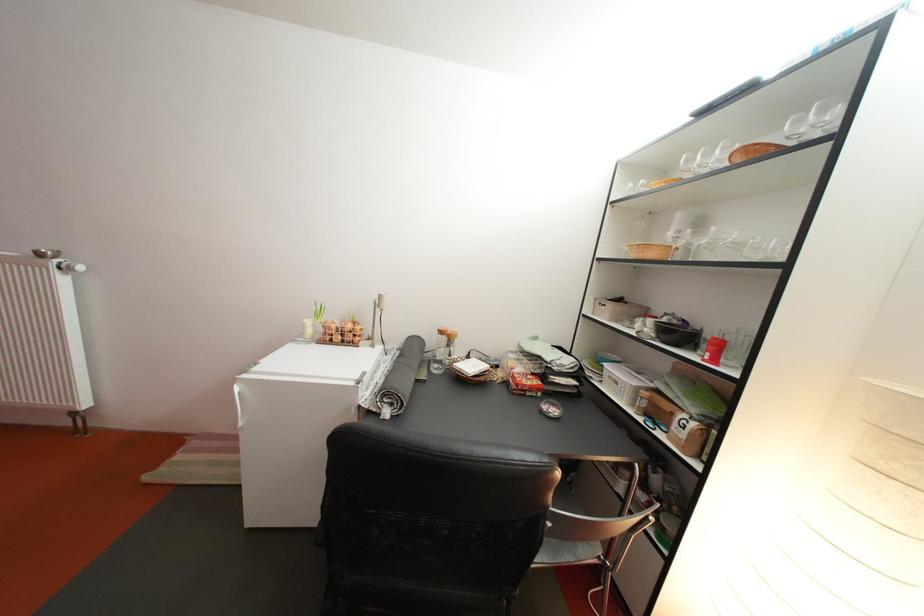
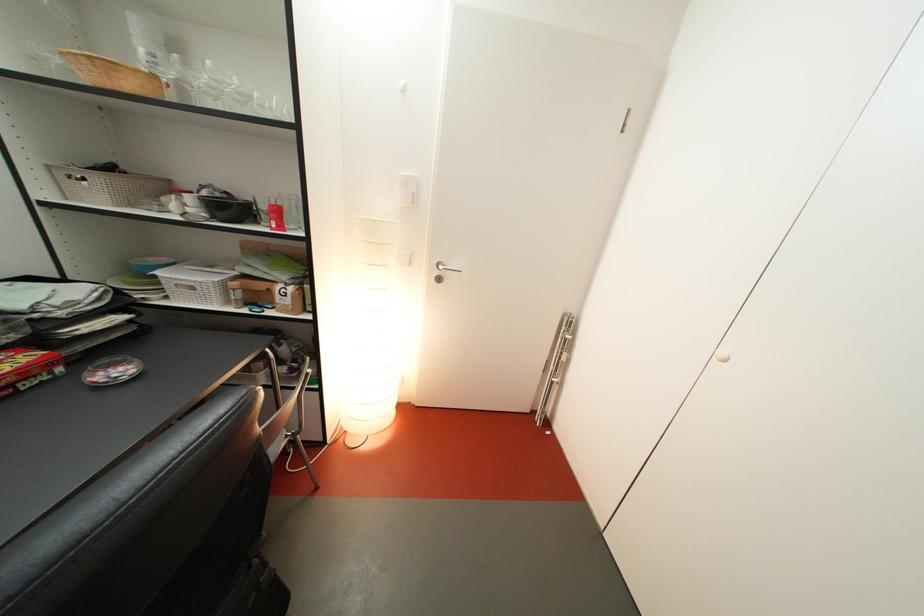
In the second image, find the point that corresponds to the point at 623,359 in the first image.

(161, 262)